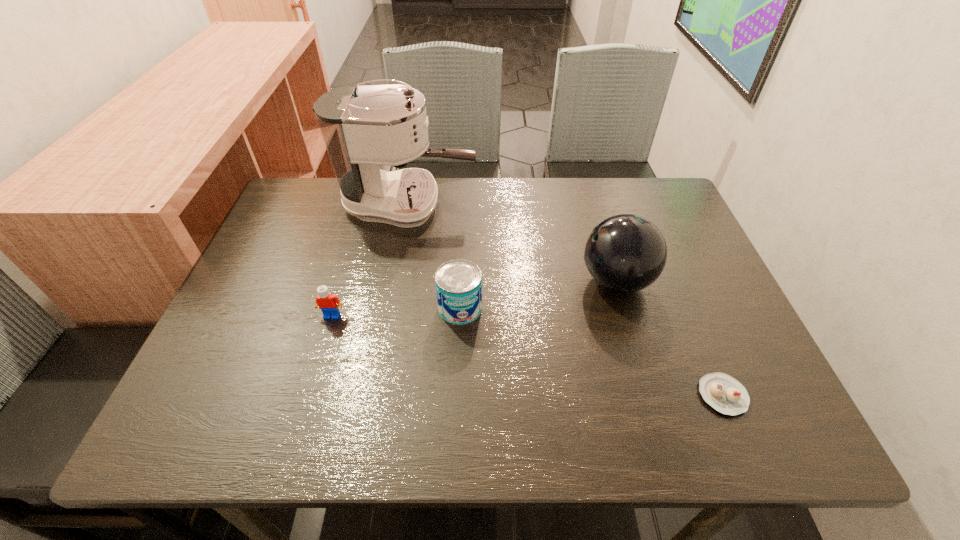
Identify the location of vacant space that satisfies the following two spatial constraints: 1. on the front-facing side of the tallest object; 2. on the back side of the can. (390, 308).

Identify the location of vacant space that satisfies the following two spatial constraints: 1. on the front-facing side of the shortest object; 2. on the right side of the tallest object. The width and height of the screenshot is (960, 540). (374, 395).

You are a GUI agent. You are given a task and a screenshot of the screen. Output one action in this format:
    pyautogui.click(x=<x>, y=<y>)
    Task: Click on the free spot that satisfies the following two spatial constraints: 1. on the side of the bowling ball with the finger holes; 2. on the right side of the shortest object
    Image resolution: width=960 pixels, height=540 pixels.
    Given the screenshot: What is the action you would take?
    pyautogui.click(x=650, y=395)

The height and width of the screenshot is (540, 960). I want to click on free space that satisfies the following two spatial constraints: 1. on the back side of the can; 2. on the front-facing side of the farthest object, so click(465, 205).

At what (x,y) coordinates should I click in order to perform the action: click on vacant region that satisfies the following two spatial constraints: 1. on the front-facing side of the coffee maker; 2. on the face of the Lego. Please return your answer as a coordinate pair (x, y). The width and height of the screenshot is (960, 540). Looking at the image, I should click on 389,315.